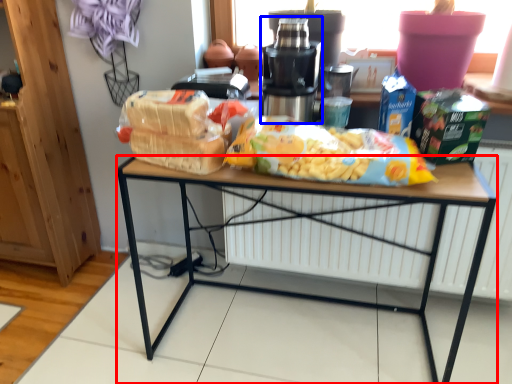
Question: Which object appears farthest to the camera in this image, desk (highlighted by a red box) or tableware (highlighted by a blue box)?

Choices:
 (A) desk
 (B) tableware

Answer: (B)